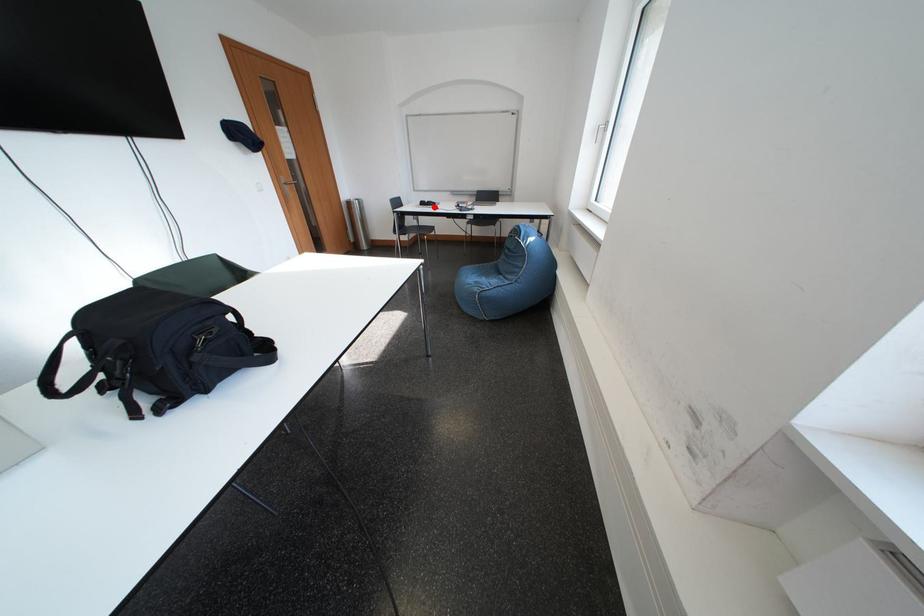
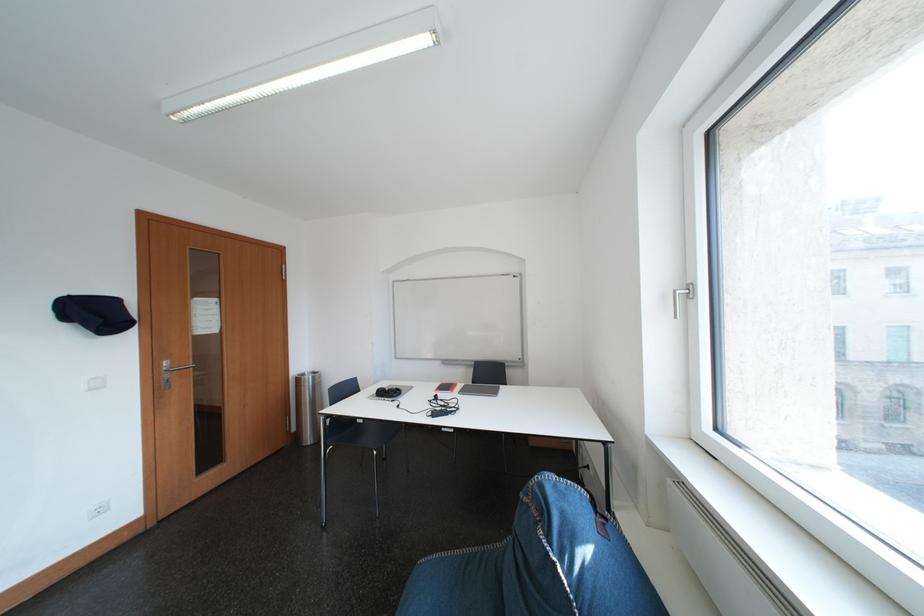
Locate, in the second image, the point that corresponds to the highlighted location in the first image.

(393, 395)